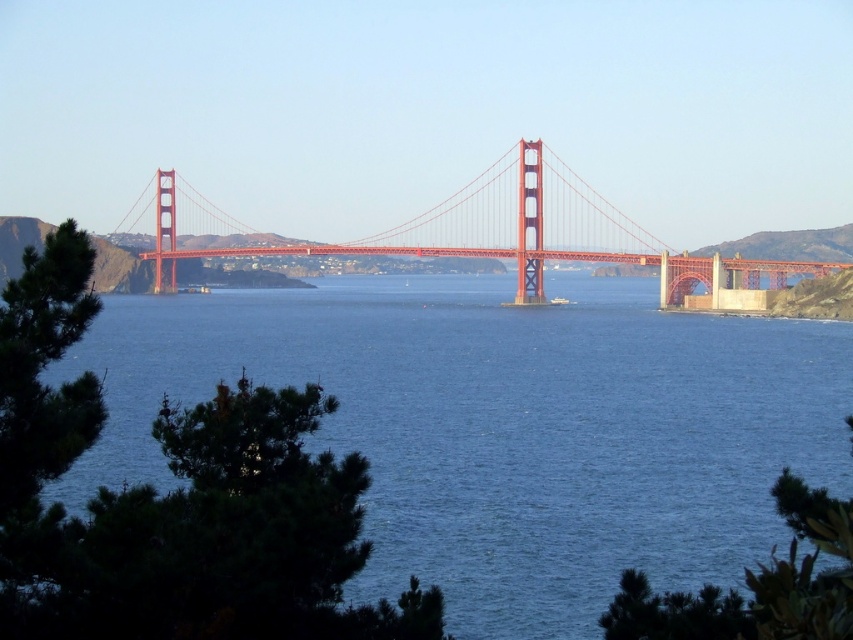
Is green matte tree at left positioned in front of green leafy tree at lower right?

That is False.

Is green matte tree at left bigger than green leafy tree at lower right?

No, green matte tree at left is not bigger than green leafy tree at lower right.

Between point (55, 236) and point (635, 596), which one is positioned behind?

Point (55, 236)

You are a GUI agent. You are given a task and a screenshot of the screen. Output one action in this format:
    pyautogui.click(x=<x>, y=<y>)
    Task: Click on the green matte tree at left
    This screenshot has width=853, height=640.
    Given the screenshot: What is the action you would take?
    pyautogui.click(x=44, y=403)

What do you see at coordinates (505, 426) in the screenshot? The image size is (853, 640). I see `blue water at center` at bounding box center [505, 426].

Who is higher up, blue water at center or green leafy tree at lower right?

blue water at center is above.

Who is more forward, (563, 509) or (804, 556)?

Positioned in front is point (804, 556).

Find the location of `blue water at center`. blue water at center is located at coordinates (505, 426).

Who is more forward, (734,276) or (41,316)?

Point (41,316) is more forward.

Is glossy steel bridge at center smaller than green matte tree at left?

Actually, glossy steel bridge at center might be larger than green matte tree at left.

Identify the location of glossy steel bridge at center. The image size is (853, 640). (473, 230).

At what (x,y) coordinates should I click in order to perform the action: click on glossy steel bridge at center. Please return your answer as a coordinate pair (x, y). The image size is (853, 640). Looking at the image, I should click on (473, 230).